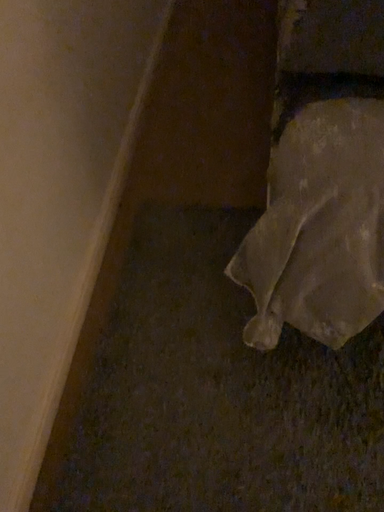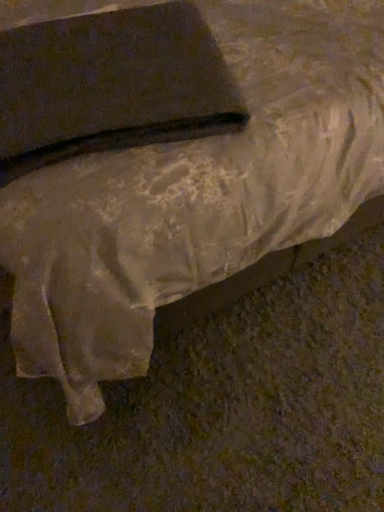
Question: Which way did the camera rotate in the video?

Choices:
 (A) rotated left
 (B) rotated right

Answer: (B)